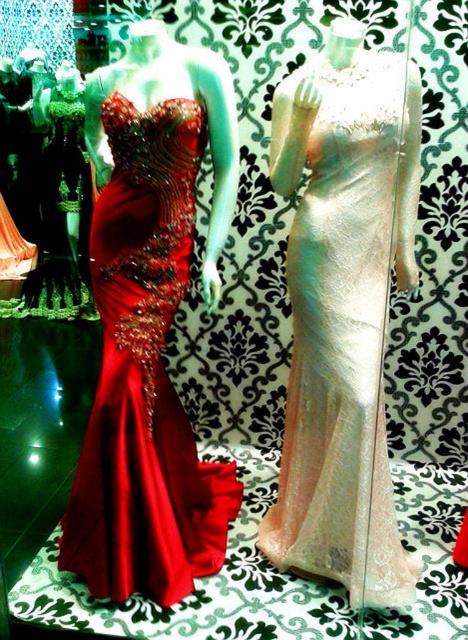
Looking at this image, you are a fashion designer who wants to display two gowns in a boutique window. The iridescent satin gown at center and the shiny satin gown at left. Which gown should you choose if you want to display a larger dress?

The shiny satin gown at left is larger in size compared to the iridescent satin gown at center, so you should choose the shiny satin gown at left for displaying a larger dress.

In the scene shown: You are a customer in a boutique and want to purchase the iridescent satin gown at center and the shiny satin gown at left. The store has a limited space for your shopping bag. Which gown should you pick first to ensure it fits in the bag?

The iridescent satin gown at center is positioned on the right side of shiny satin gown at left, so you should pick the shiny satin gown at left first as it is closer to you, allowing easier access to place it in the bag before the other.

You are a customer in the boutique and want to know which gown is taller between the iridescent satin gown at center and the shiny satin gown at left. Can you tell me which one is taller?

The iridescent satin gown at center is much taller than the shiny satin gown at left.